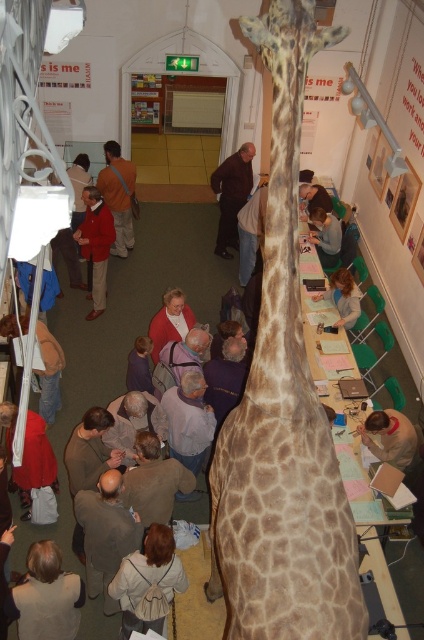
Question: Which of the following is the farthest from the observer?

Choices:
 (A) brown wool sweater at lower center
 (B) light brown backpack at lower center
 (C) brown wool sweater at center

Answer: (C)

Question: Which of the following is the farthest from the observer?

Choices:
 (A) (228, 177)
 (B) (404, 417)

Answer: (A)

Question: Is light brown backpack at lower center smaller than light blue shirt at center?

Choices:
 (A) no
 (B) yes

Answer: (B)

Question: Which point is closer to the camera?

Choices:
 (A) (373, 436)
 (B) (351, 312)
 (C) (276, 588)

Answer: (C)

Question: Can you confirm if light brown leather jacket at lower left is positioned below brown wool sweater at lower center?

Choices:
 (A) no
 (B) yes

Answer: (B)

Question: Considering the relative positions of light brown backpack at lower center and light brown leather jacket at lower left in the image provided, where is light brown backpack at lower center located with respect to light brown leather jacket at lower left?

Choices:
 (A) right
 (B) left

Answer: (A)